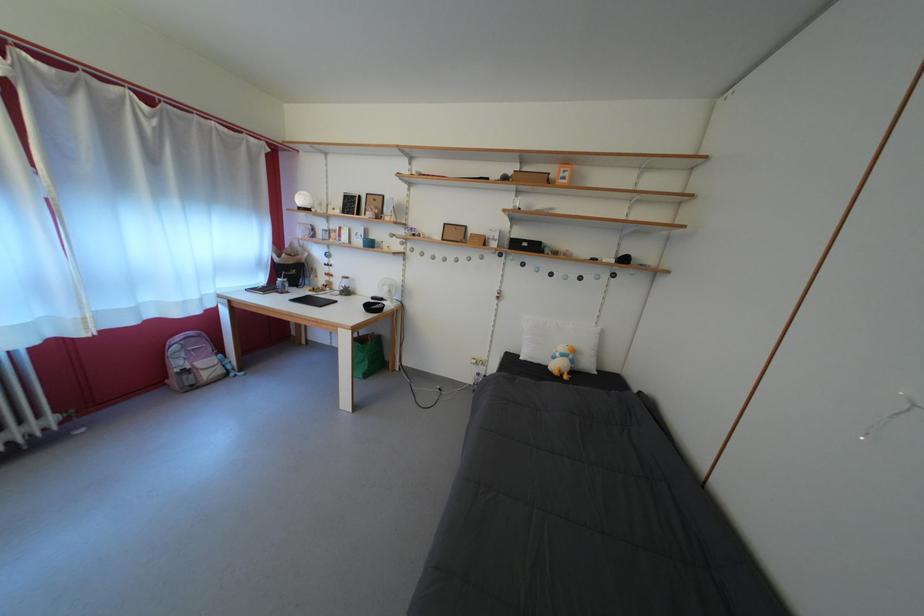
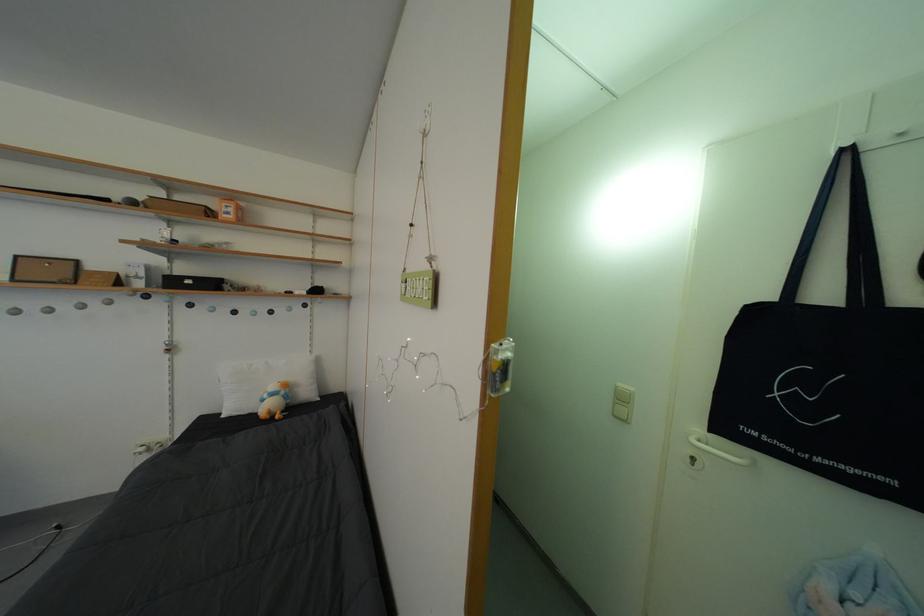
Question: The camera is either moving clockwise (left) or counter-clockwise (right) around the object. The first image is from the beginning of the video and the second image is from the end. Is the camera moving left or right when shooting the video?

Choices:
 (A) Left
 (B) Right

Answer: (A)